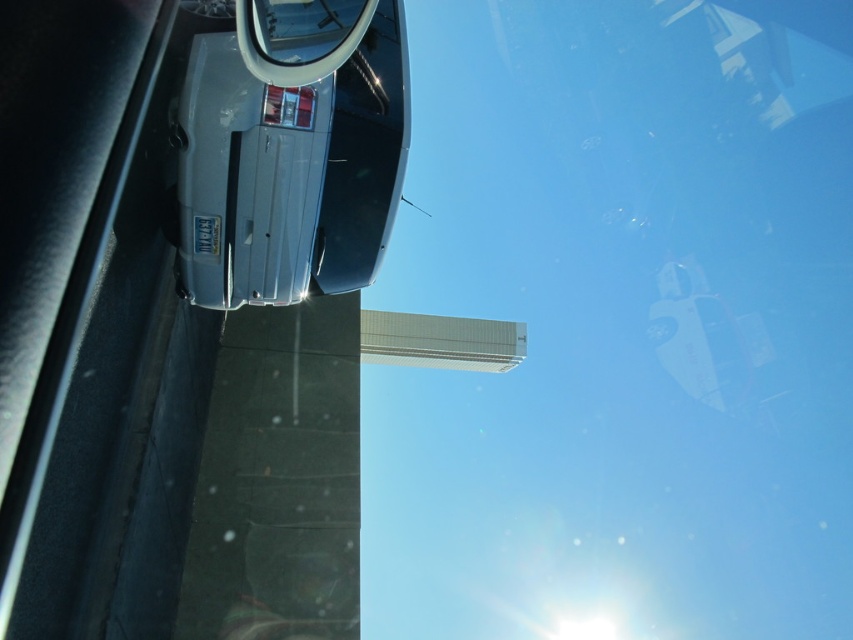
Question: Which point is farther to the camera?

Choices:
 (A) (257, 56)
 (B) (227, 204)

Answer: (B)

Question: Does satin silver car at upper left appear on the left side of clear glass rearview mirror at upper center?

Choices:
 (A) no
 (B) yes

Answer: (B)

Question: Can you confirm if satin silver car at upper left is thinner than clear glass rearview mirror at upper center?

Choices:
 (A) yes
 (B) no

Answer: (B)

Question: Observing the image, what is the correct spatial positioning of satin silver car at upper left in reference to clear glass rearview mirror at upper center?

Choices:
 (A) right
 (B) left

Answer: (B)